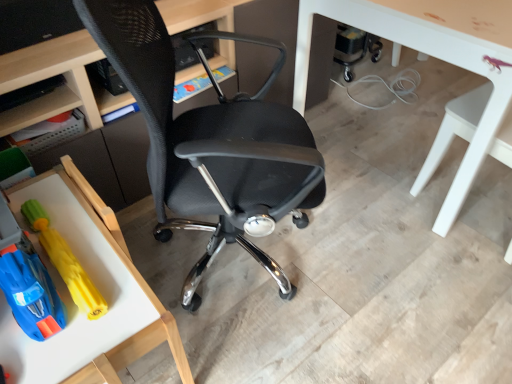
Question: Is matte black desk at center at the left side of wooden tray at lower left, which is the first table in bottom-to-top order?

Choices:
 (A) no
 (B) yes

Answer: (A)

Question: Is wooden tray at lower left, the 2th table when ordered from top to bottom, a part of matte black desk at center?

Choices:
 (A) yes
 (B) no

Answer: (B)

Question: From a real-world perspective, is matte black desk at center over wooden tray at lower left, arranged as the first table when viewed from the left?

Choices:
 (A) yes
 (B) no

Answer: (A)

Question: From the image's perspective, is matte black desk at center below wooden tray at lower left, the 2th table when ordered from top to bottom?

Choices:
 (A) yes
 (B) no

Answer: (B)

Question: Would you say matte black desk at center is a long distance from wooden tray at lower left, placed as the 2th table when sorted from right to left?

Choices:
 (A) no
 (B) yes

Answer: (A)

Question: Is matte black desk at center wider than wooden tray at lower left, the 2th table when ordered from top to bottom?

Choices:
 (A) no
 (B) yes

Answer: (A)

Question: Is rubberized yellow toy at lower left, the first toy positioned from the left, far away from white glossy table at right, the second chair in the left-to-right sequence?

Choices:
 (A) yes
 (B) no

Answer: (A)

Question: Is rubberized yellow toy at lower left, the second toy when ordered from right to left, positioned beyond the bounds of white glossy table at right, which ranks as the first chair in right-to-left order?

Choices:
 (A) no
 (B) yes

Answer: (B)

Question: Is the position of rubberized yellow toy at lower left, the first toy positioned from the left, more distant than that of white glossy table at right, the second chair in the left-to-right sequence?

Choices:
 (A) yes
 (B) no

Answer: (B)

Question: Considering the relative sizes of rubberized yellow toy at lower left, the first toy positioned from the left, and white glossy table at right, which ranks as the first chair in right-to-left order, in the image provided, is rubberized yellow toy at lower left, the first toy positioned from the left, thinner than white glossy table at right, which ranks as the first chair in right-to-left order,?

Choices:
 (A) yes
 (B) no

Answer: (B)

Question: From the image's perspective, is rubberized yellow toy at lower left, the second toy when ordered from right to left, located above white glossy table at right, which ranks as the first chair in right-to-left order?

Choices:
 (A) yes
 (B) no

Answer: (B)

Question: From a real-world perspective, is rubberized yellow toy at lower left, the first toy positioned from the left, located higher than white glossy table at right, which ranks as the first chair in right-to-left order?

Choices:
 (A) no
 (B) yes

Answer: (B)

Question: Is wooden tray at lower left, placed as the 2th table when sorted from right to left, smaller than yellow rubber toy at lower left, the 1th toy from the right?

Choices:
 (A) yes
 (B) no

Answer: (B)